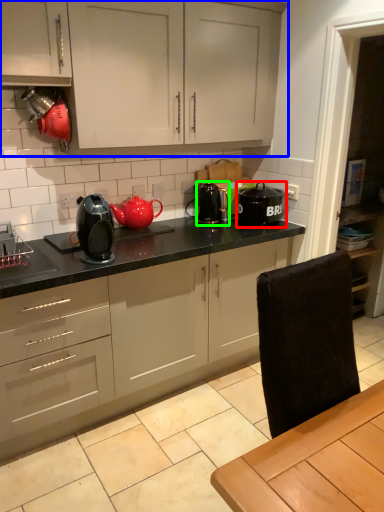
Question: Which object is the closest to the kitchen appliance (highlighted by a red box)? Choose among these: cabinetry (highlighted by a blue box) or appliance (highlighted by a green box).

Choices:
 (A) cabinetry
 (B) appliance

Answer: (B)